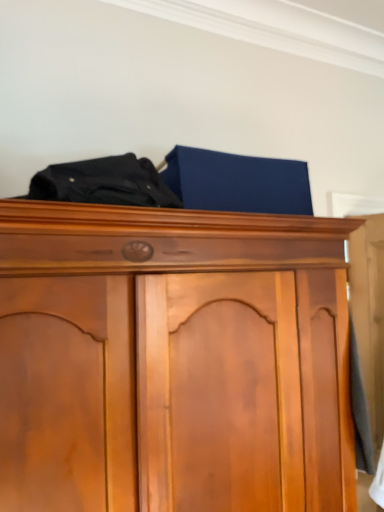
Question: Is black fabric at upper center placed right next to wooden wardrobe at upper center?

Choices:
 (A) no
 (B) yes

Answer: (A)

Question: Does black fabric at upper center have a lesser width compared to wooden wardrobe at upper center?

Choices:
 (A) yes
 (B) no

Answer: (A)

Question: Would you consider black fabric at upper center to be distant from wooden wardrobe at upper center?

Choices:
 (A) no
 (B) yes

Answer: (A)

Question: Is black fabric at upper center shorter than wooden wardrobe at upper center?

Choices:
 (A) no
 (B) yes

Answer: (B)

Question: Is black fabric at upper center surrounding wooden wardrobe at upper center?

Choices:
 (A) no
 (B) yes

Answer: (A)

Question: From the image's perspective, is black fabric at upper center beneath wooden wardrobe at upper center?

Choices:
 (A) yes
 (B) no

Answer: (B)

Question: Does wooden wardrobe at upper center contain black fabric at upper center?

Choices:
 (A) no
 (B) yes

Answer: (A)

Question: Can you confirm if wooden wardrobe at upper center is wider than black fabric at upper center?

Choices:
 (A) yes
 (B) no

Answer: (A)

Question: Can you confirm if wooden wardrobe at upper center is taller than black fabric at upper center?

Choices:
 (A) no
 (B) yes

Answer: (B)

Question: Is wooden wardrobe at upper center facing towards black fabric at upper center?

Choices:
 (A) no
 (B) yes

Answer: (A)

Question: Is the position of wooden wardrobe at upper center more distant than that of black fabric at upper center?

Choices:
 (A) no
 (B) yes

Answer: (A)

Question: From the image's perspective, is wooden wardrobe at upper center located beneath black fabric at upper center?

Choices:
 (A) no
 (B) yes

Answer: (B)

Question: Is point (97, 198) closer or farther from the camera than point (162, 419)?

Choices:
 (A) closer
 (B) farther

Answer: (A)